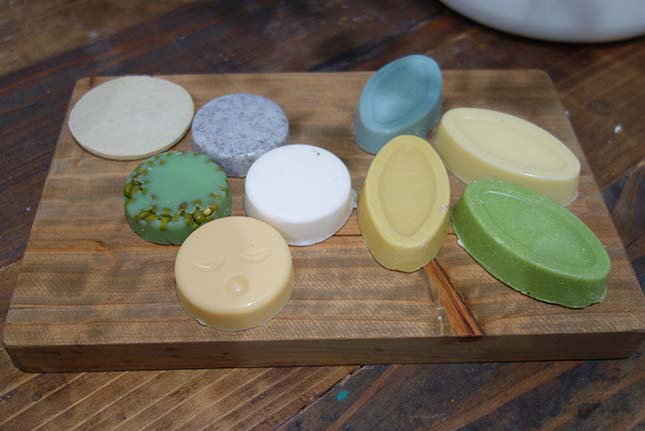
Where is `wooden surface`? This screenshot has width=645, height=431. wooden surface is located at coordinates (135, 314), (232, 397).